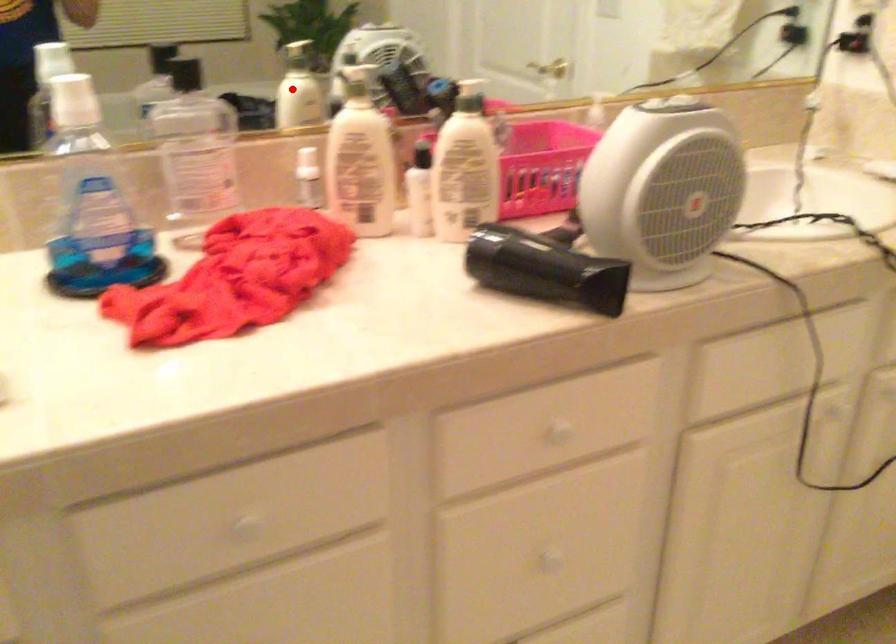
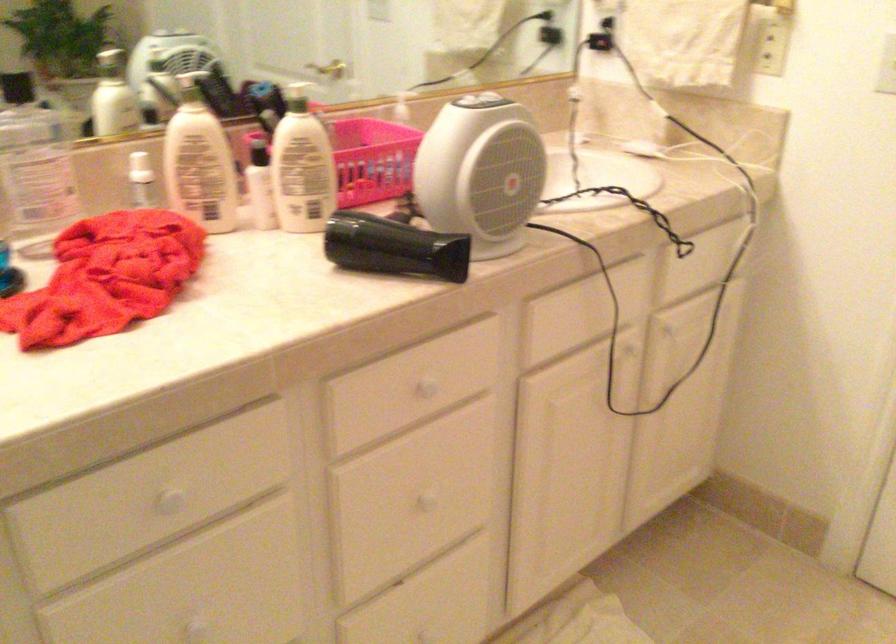
Locate, in the second image, the point that corresponds to the highlighted location in the first image.

(113, 97)